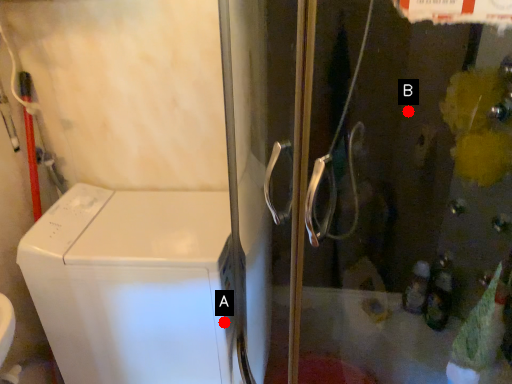
Question: Two points are circled on the image, labeled by A and B beside each circle. Which point appears farthest from the camera in this image?

Choices:
 (A) A is further
 (B) B is further

Answer: (A)